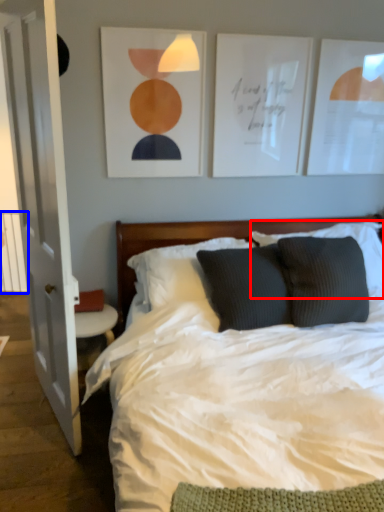
Question: Which object appears closest to the camera in this image, pillow (highlighted by a red box) or balustrade (highlighted by a blue box)?

Choices:
 (A) pillow
 (B) balustrade

Answer: (A)